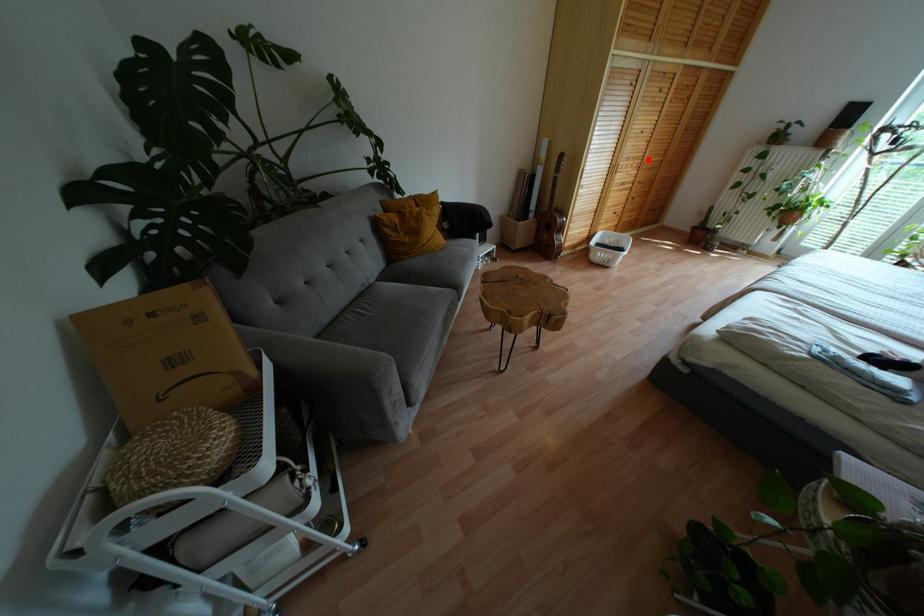
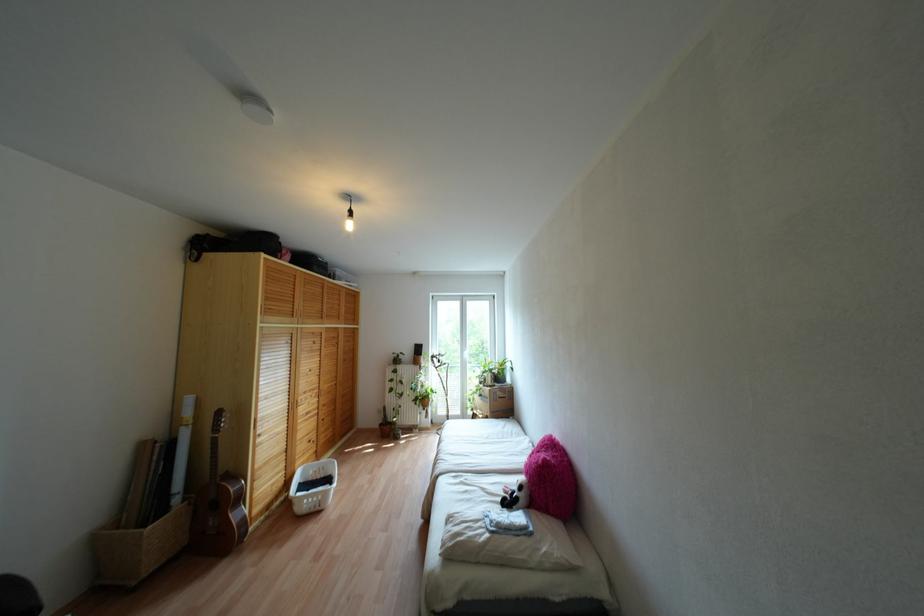
Question: I am providing you with two images of the same scene from different viewpoints. Given a red point in image1, look at the same physical point in image2. Is it:

Choices:
 (A) Closer to the viewpoint
 (B) Farther from the viewpoint

Answer: (B)